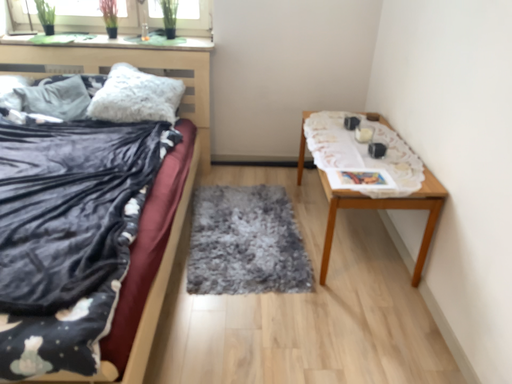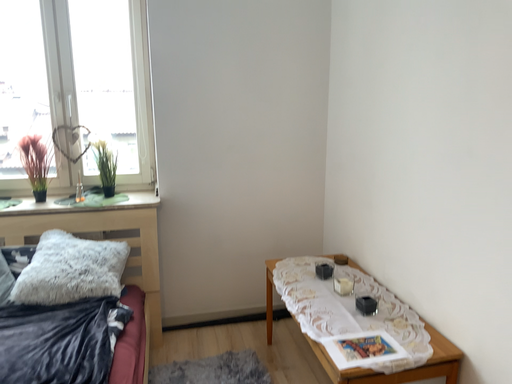
Question: Which way did the camera rotate in the video?

Choices:
 (A) rotated right
 (B) rotated left

Answer: (A)